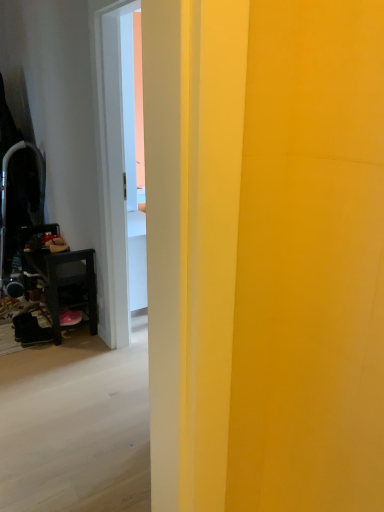
Identify the location of vacant area that lies in front of black suede boot at lower left, the 1th footwear from the left. (33, 357).